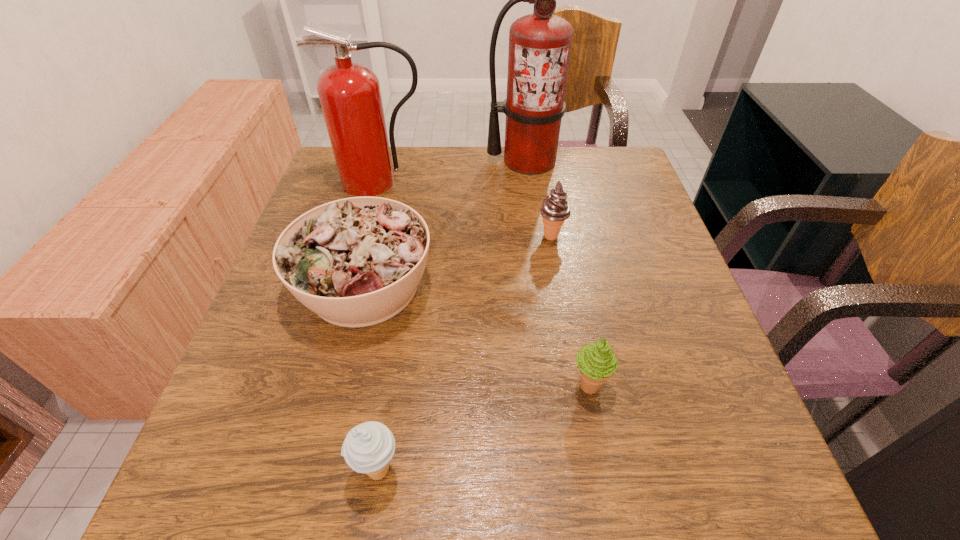
The width and height of the screenshot is (960, 540). In order to click on the tallest object in this screenshot , I will do `click(540, 44)`.

In order to click on the right fire extinguisher in this screenshot , I will do `click(540, 44)`.

Locate an element on the screen. This screenshot has width=960, height=540. the left fire extinguisher is located at coordinates (350, 96).

Identify the location of the second tallest object. The height and width of the screenshot is (540, 960). (350, 96).

You are a GUI agent. You are given a task and a screenshot of the screen. Output one action in this format:
    pyautogui.click(x=<x>, y=<y>)
    Task: Click on the farthest icecream
    This screenshot has height=540, width=960.
    Given the screenshot: What is the action you would take?
    pyautogui.click(x=555, y=209)

What are the coordinates of `salad` in the screenshot? It's located at (355, 262).

You are a GUI agent. You are given a task and a screenshot of the screen. Output one action in this format:
    pyautogui.click(x=<x>, y=<y>)
    Task: Click on the second farthest icecream
    This screenshot has width=960, height=540.
    Given the screenshot: What is the action you would take?
    pyautogui.click(x=597, y=363)

Locate an element on the screen. Image resolution: width=960 pixels, height=540 pixels. the nearest icecream is located at coordinates (368, 448).

Identify the location of the nearest object. (368, 448).

This screenshot has width=960, height=540. Identify the location of vacant space located 0.270m toward the nozzle of the tallest object. (539, 241).